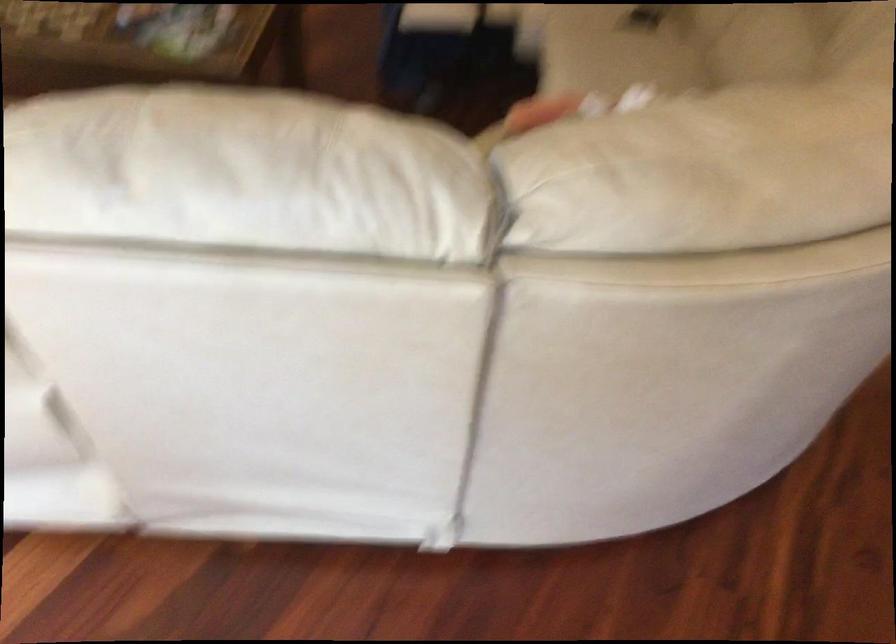
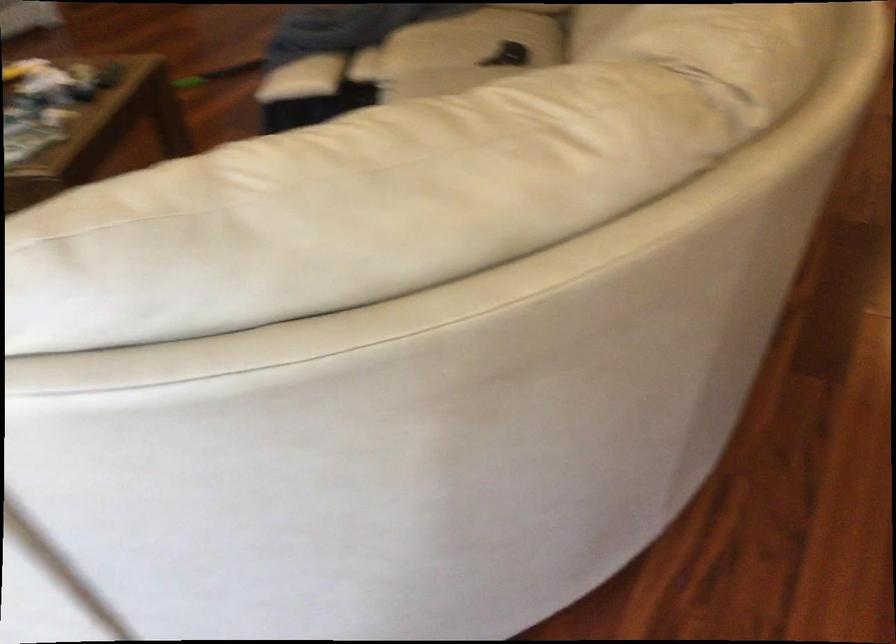
Question: The images are taken continuously from a first-person perspective. In which direction is your viewpoint rotating?

Choices:
 (A) Left
 (B) Right
 (C) Up
 (D) Down

Answer: (C)